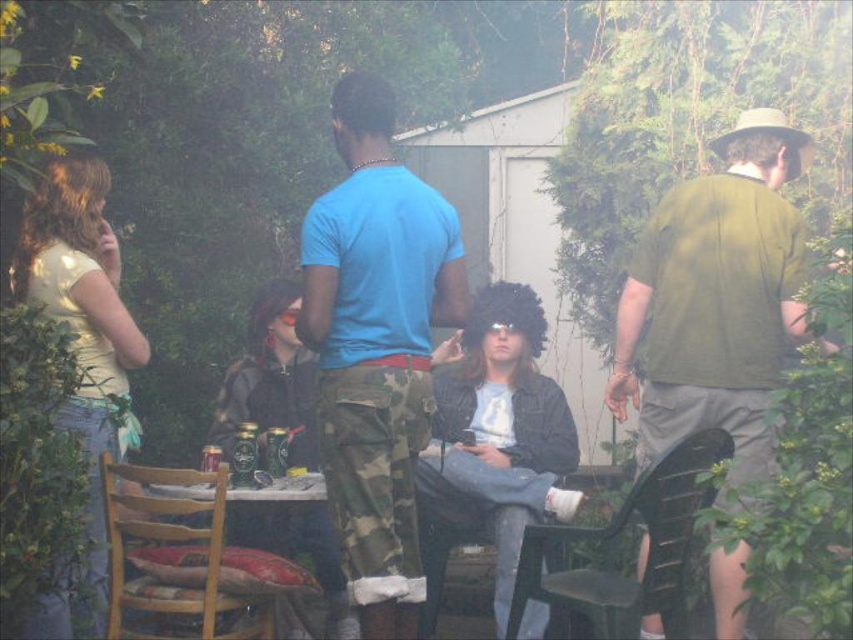
Question: Is blue t-shirt at center bigger than wooden chair at lower left?

Choices:
 (A) no
 (B) yes

Answer: (A)

Question: Which of the following is the closest to the observer?

Choices:
 (A) blue t-shirt at center
 (B) green matte shirt at right
 (C) black plastic chair at lower right
 (D) wooden chair at lower left

Answer: (C)

Question: Which of the following is the closest to the observer?

Choices:
 (A) black plastic chair at lower right
 (B) green matte shirt at right
 (C) blue t-shirt at center

Answer: (A)

Question: Which point is farther to the camera?

Choices:
 (A) (608, 544)
 (B) (180, 611)
 (C) (392, 314)

Answer: (A)

Question: Can you confirm if black plastic chair at lower right is smaller than wooden chair at lower left?

Choices:
 (A) no
 (B) yes

Answer: (A)

Question: Can you confirm if blue t-shirt at center is wider than black plastic chair at lower right?

Choices:
 (A) no
 (B) yes

Answer: (A)